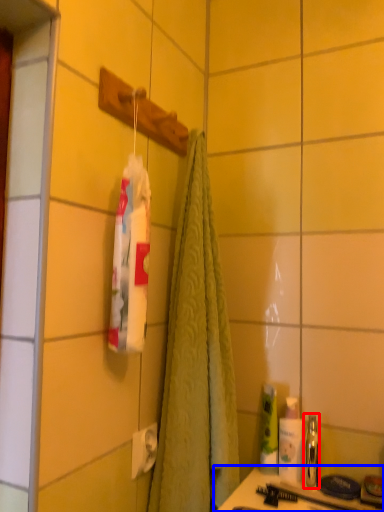
Question: Which of the following is the closest to the observer, mouthwash (highlighted by a red box) or counter (highlighted by a blue box)?

Choices:
 (A) mouthwash
 (B) counter

Answer: (B)